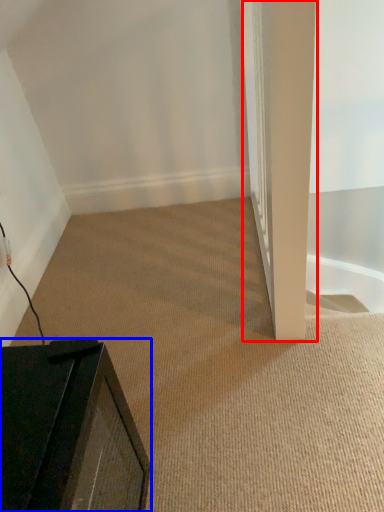
Question: Which point is further to the camera, pillar (highlighted by a red box) or furniture (highlighted by a blue box)?

Choices:
 (A) pillar
 (B) furniture

Answer: (A)